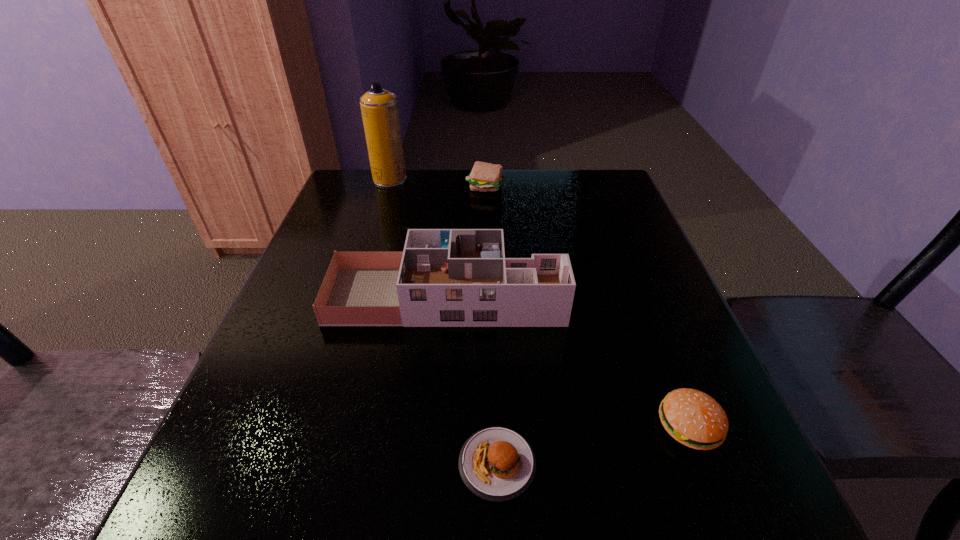
You are a GUI agent. You are given a task and a screenshot of the screen. Output one action in this format:
    pyautogui.click(x=<x>, y=<y>)
    Task: Click on the object that ranks as the second closest to the farthest food
    The image size is (960, 540).
    Given the screenshot: What is the action you would take?
    pyautogui.click(x=444, y=277)

Select which object appears as the closest to the farthest food. Please provide its 2D coordinates. Your answer should be formatted as a tuple, i.e. [(x, y)], where the tuple contains the x and y coordinates of a point satisfying the conditions above.

[(379, 108)]

You are a GUI agent. You are given a task and a screenshot of the screen. Output one action in this format:
    pyautogui.click(x=<x>, y=<y>)
    Task: Click on the food that is the closest to the dollhouse
    
    Given the screenshot: What is the action you would take?
    pyautogui.click(x=693, y=418)

Choose which food is the nearest neighbor to the shortest food. Please provide its 2D coordinates. Your answer should be formatted as a tuple, i.e. [(x, y)], where the tuple contains the x and y coordinates of a point satisfying the conditions above.

[(693, 418)]

At what (x,y) coordinates should I click in order to perform the action: click on vacant space that satisfies the following two spatial constraints: 1. at the entrance of the third farthest object; 2. on the back side of the second tallest food. Please return your answer as a coordinate pair (x, y). This screenshot has width=960, height=540. Looking at the image, I should click on (435, 426).

I want to click on free region that satisfies the following two spatial constraints: 1. at the entrance of the shortest food; 2. on the right side of the dollhouse, so click(x=432, y=464).

The width and height of the screenshot is (960, 540). I want to click on free spot that satisfies the following two spatial constraints: 1. on the front side of the tallest object; 2. on the left side of the shortest object, so click(x=300, y=464).

You are a GUI agent. You are given a task and a screenshot of the screen. Output one action in this format:
    pyautogui.click(x=<x>, y=<y>)
    Task: Click on the free location that satisfies the following two spatial constraints: 1. on the front side of the farthest food; 2. on the right side of the rightmost food
    
    Given the screenshot: What is the action you would take?
    pyautogui.click(x=489, y=426)

Locate an element on the screen. The width and height of the screenshot is (960, 540). free region that satisfies the following two spatial constraints: 1. at the entrance of the dollhouse; 2. on the right side of the shortest object is located at coordinates (432, 464).

Identify the location of vacant region that satisfies the following two spatial constraints: 1. at the entrance of the fourth shortest object; 2. on the left side of the rightmost object. (435, 426).